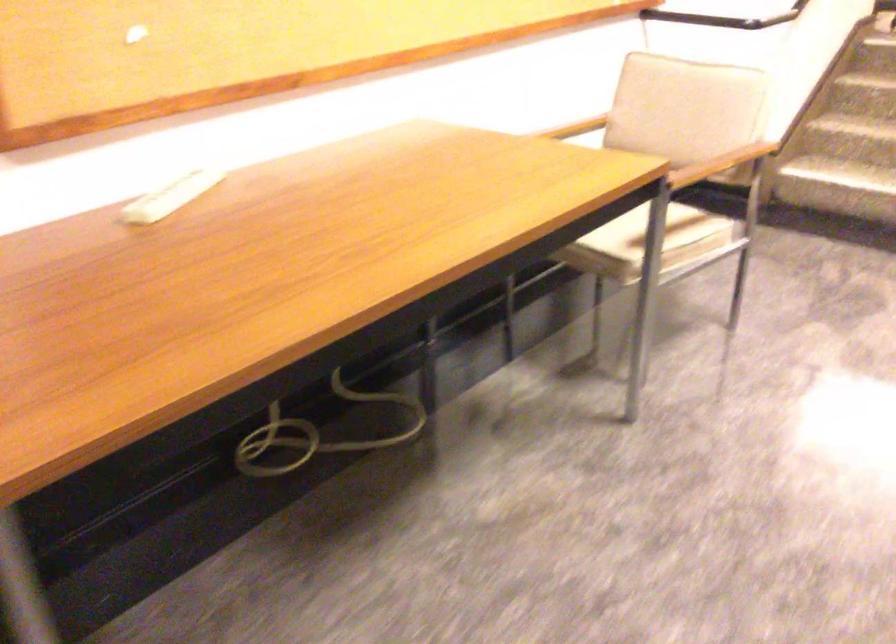
The width and height of the screenshot is (896, 644). What do you see at coordinates (574, 128) in the screenshot?
I see `the wooden chair armrest` at bounding box center [574, 128].